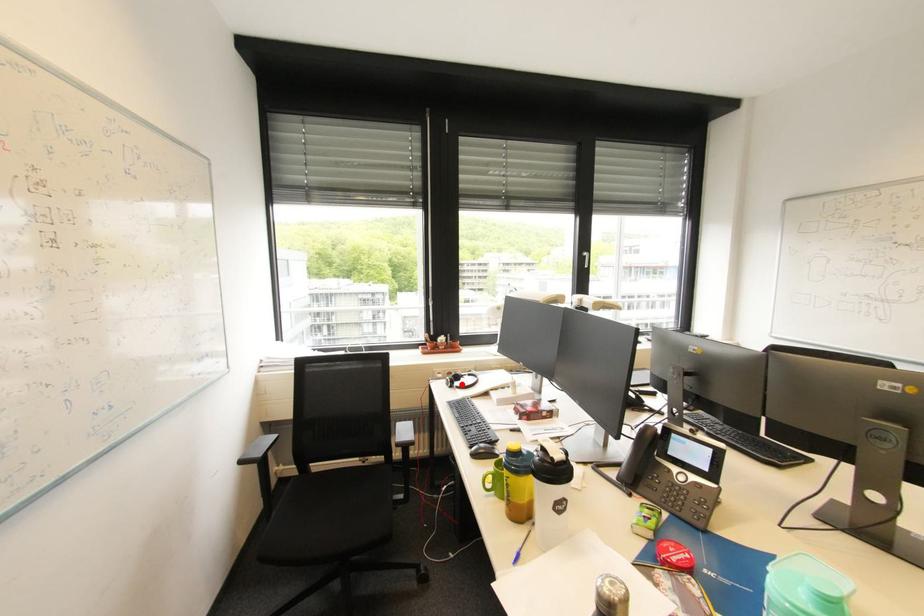
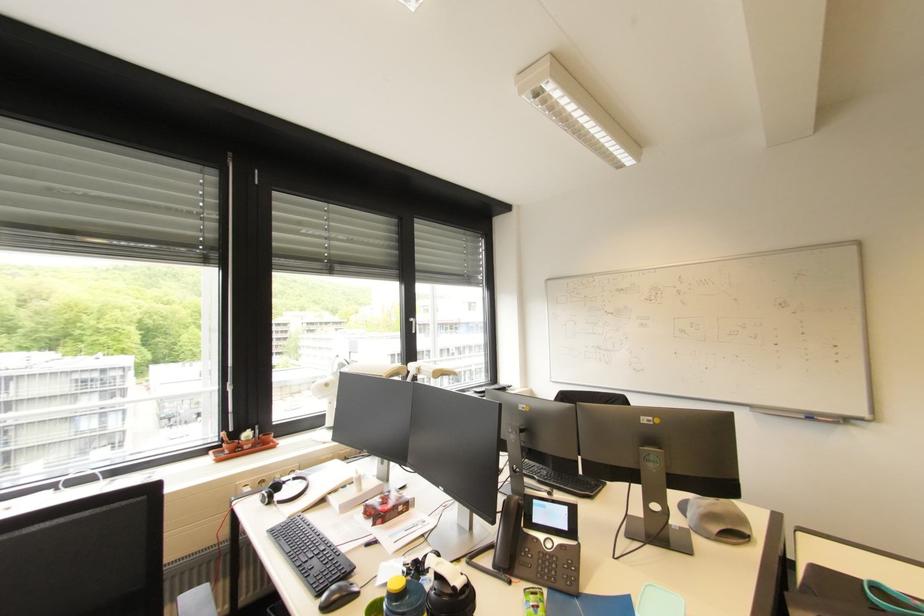
Where in the second image is the point corresponding to the highlighted location from the first image?

(283, 498)